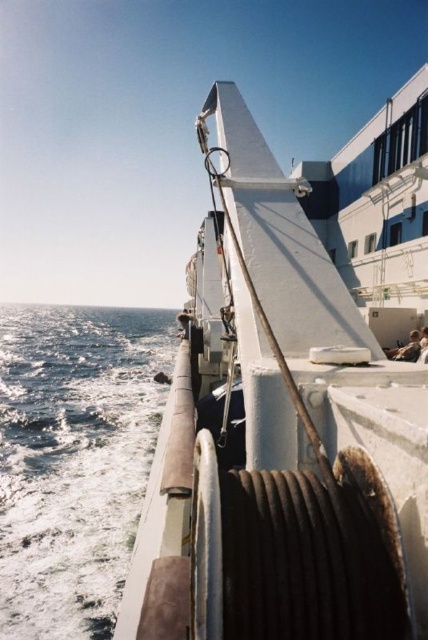
Question: Can you confirm if white matte boat at center is wider than blue water at lower left?

Choices:
 (A) yes
 (B) no

Answer: (B)

Question: Can you confirm if white matte boat at center is positioned above blue water at lower left?

Choices:
 (A) no
 (B) yes

Answer: (B)

Question: Which of the following is the closest to the observer?

Choices:
 (A) white matte boat at center
 (B) blue water at lower left

Answer: (A)

Question: Observing the image, what is the correct spatial positioning of white matte boat at center in reference to blue water at lower left?

Choices:
 (A) left
 (B) right

Answer: (B)